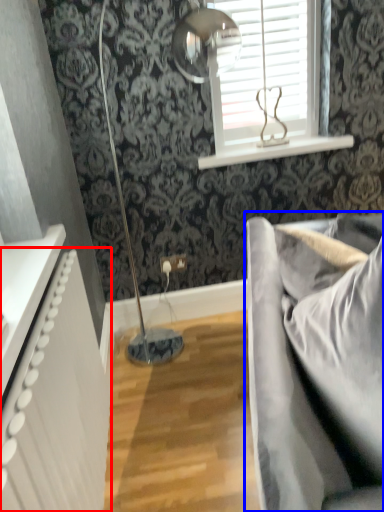
Question: Among these objects, which one is nearest to the camera, radiator (highlighted by a red box) or studio couch (highlighted by a blue box)?

Choices:
 (A) radiator
 (B) studio couch

Answer: (B)